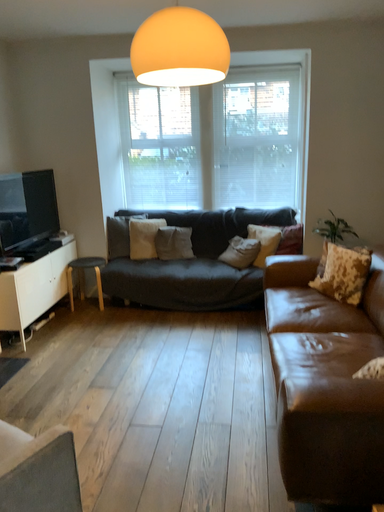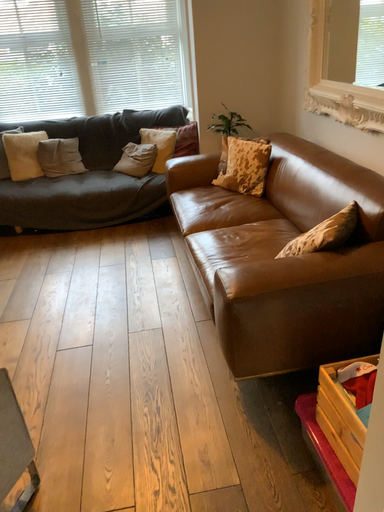
Question: Which way did the camera rotate in the video?

Choices:
 (A) rotated right
 (B) rotated left

Answer: (A)